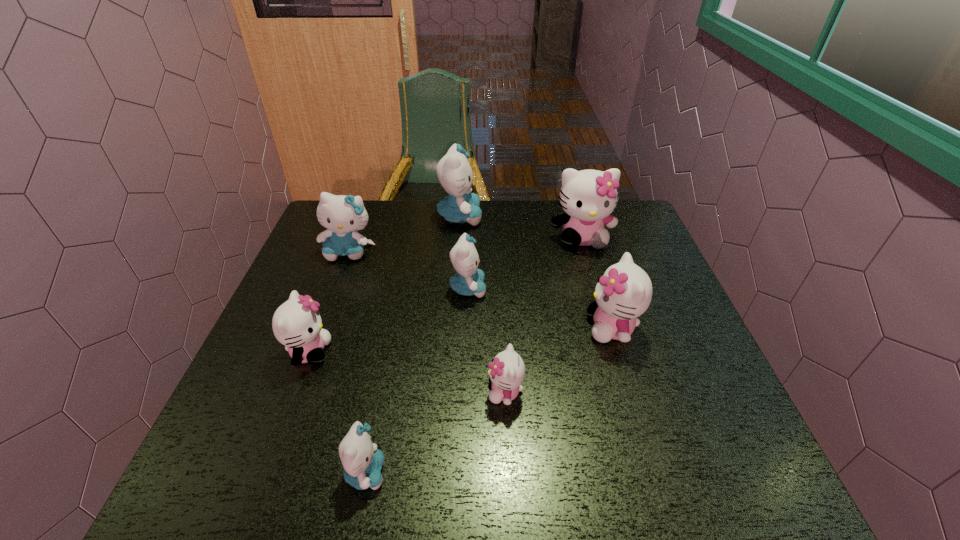
The image size is (960, 540). Find the location of `free region located 0.140m on the front-facing side of the smallest white kitten`. free region located 0.140m on the front-facing side of the smallest white kitten is located at coordinates (421, 392).

At what (x,y) coordinates should I click in order to perform the action: click on vacant region located 0.130m on the face of the nearest kitten. Please return your answer as a coordinate pair (x, y). The image size is (960, 540). Looking at the image, I should click on (457, 472).

You are a GUI agent. You are given a task and a screenshot of the screen. Output one action in this format:
    pyautogui.click(x=<x>, y=<y>)
    Task: Click on the object located in the near edge section of the desktop
    
    Given the screenshot: What is the action you would take?
    pyautogui.click(x=362, y=461)

What are the coordinates of `object located at the far left corner` in the screenshot? It's located at (342, 215).

You are a GUI agent. You are given a task and a screenshot of the screen. Output one action in this format:
    pyautogui.click(x=<x>, y=<y>)
    Task: Click on the object that is positioned at the far right corner
    This screenshot has width=960, height=540.
    Given the screenshot: What is the action you would take?
    pyautogui.click(x=588, y=197)

Find the location of `vacant space at the far edge of the desktop`. vacant space at the far edge of the desktop is located at coordinates (523, 207).

Where is `vacant space at the near edge`? The height and width of the screenshot is (540, 960). vacant space at the near edge is located at coordinates (663, 476).

The width and height of the screenshot is (960, 540). Identify the location of vacant point at the left edge. (306, 363).

Locate an element on the screen. Image resolution: width=960 pixels, height=540 pixels. vacant space at the right edge of the desktop is located at coordinates (664, 376).

The width and height of the screenshot is (960, 540). In the image, there is a desktop. Identify the location of free region at the near left corner. (233, 459).